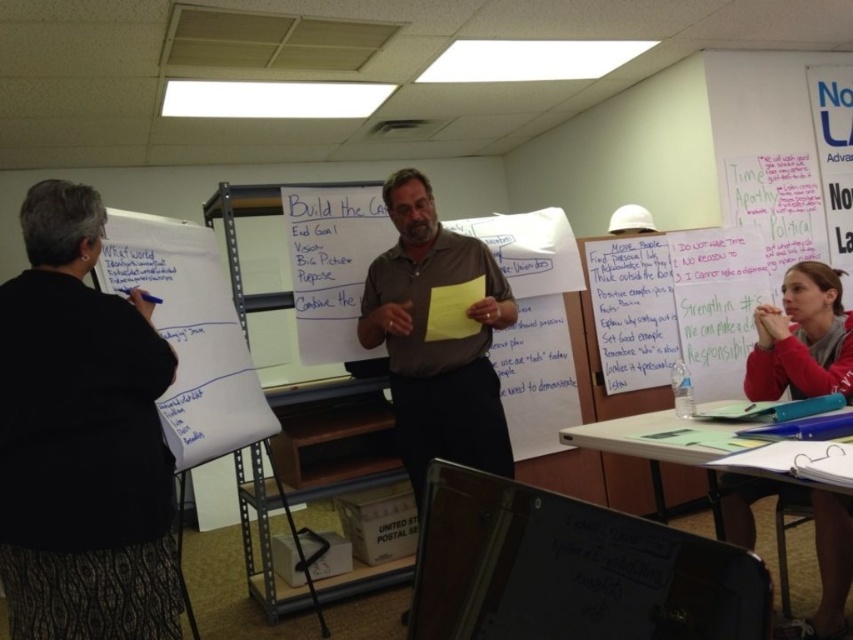
You are organizing a clothing donation drive and need to determine which item takes up more space in the donation box. Based on the image, which object between the brown smooth shirt at center and the red fleece jacket at lower right has a greater width?

The brown smooth shirt at center has a greater width than the red fleece jacket at lower right, so it takes up more space in the donation box.

You are a participant in the meeting and need to pass a note to the person wearing the black textured sweater at left. You currently have the white paper at lower right. Can you reach them without moving from your current position?

The black textured sweater at left and white paper at lower right are 5.21 feet apart from each other. Since the distance is 5.21 feet, you would need to stretch or move closer to reach them, so it might be challenging to pass the note without moving.